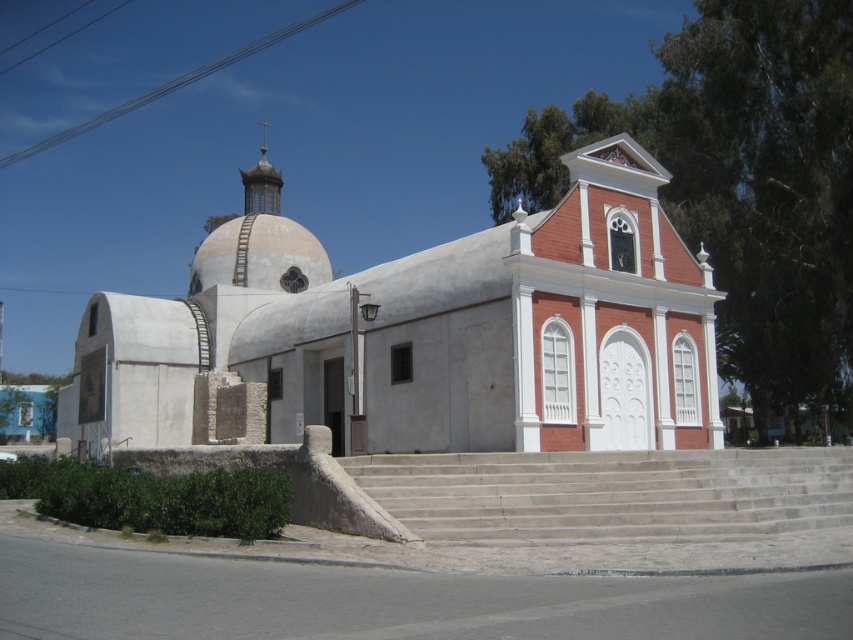
Question: Which of the following is the farthest from the observer?

Choices:
 (A) (662, 387)
 (B) (524, 492)

Answer: (A)

Question: Which point appears farthest from the camera in this image?

Choices:
 (A) (212, 349)
 (B) (763, 518)

Answer: (A)

Question: Does white stucco chapel at center appear on the right side of gray concrete stairs at center?

Choices:
 (A) no
 (B) yes

Answer: (A)

Question: From the image, what is the correct spatial relationship of white stucco chapel at center in relation to gray concrete stairs at center?

Choices:
 (A) left
 (B) right

Answer: (A)

Question: Which of the following is the farthest from the observer?

Choices:
 (A) (114, 292)
 (B) (749, 456)

Answer: (A)

Question: From the image, what is the correct spatial relationship of white stucco chapel at center in relation to gray concrete stairs at center?

Choices:
 (A) below
 (B) above

Answer: (B)